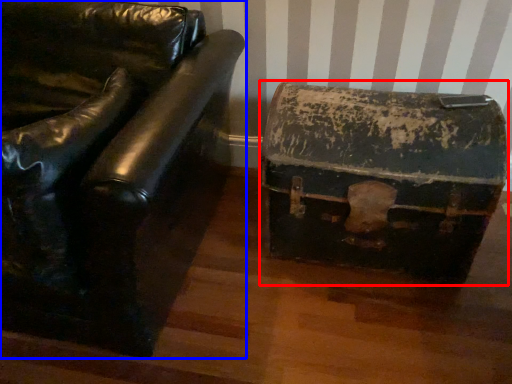
Question: Which object appears closest to the camera in this image, storage box (highlighted by a red box) or furniture (highlighted by a blue box)?

Choices:
 (A) storage box
 (B) furniture

Answer: (B)